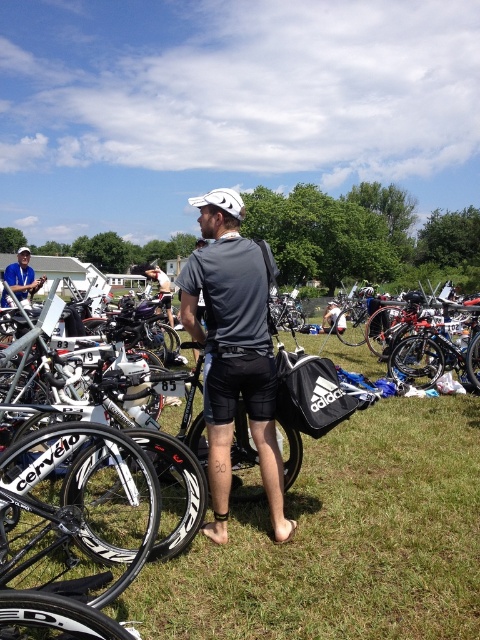
You are a photographer at the event and need to position yourself to capture a photo of the black matte bag at center without any bicycles blocking it. Based on the scene description, where should you stand relative to the bag?

The black matte bag at center is positioned at point (343, 541). Since the bicycles are lined up in the midground on the grass and the man is standing in the foreground, positioning yourself behind the man or to the side where there are no bicycles would ensure an unobstructed view of the bag.

You are a photographer at the event and want to capture a clear shot of the shiny blue frame at center without any obstruction. Given that the matte gray shirt at center is between you and the frame, can you adjust your position to do so?

The shiny blue frame at center is in front of the matte gray shirt at center, so you cannot adjust your position to capture the shiny blue frame at center without the matte gray shirt at center obstructing the view.